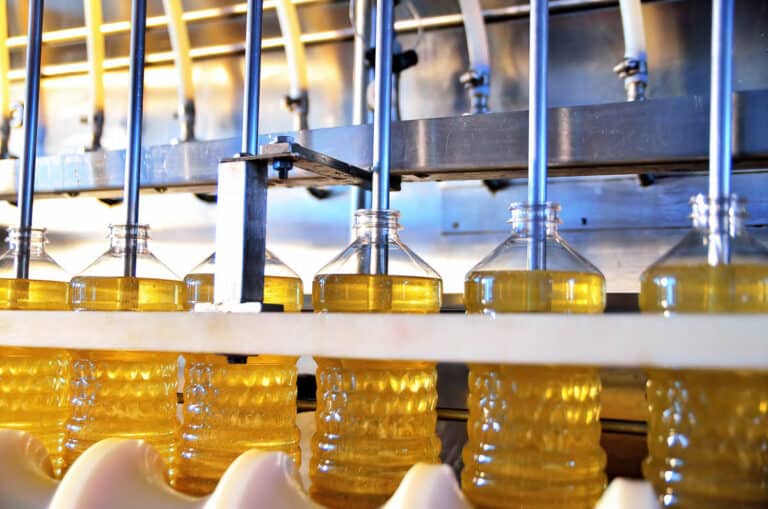
Identify the location of bottle. (409, 266).